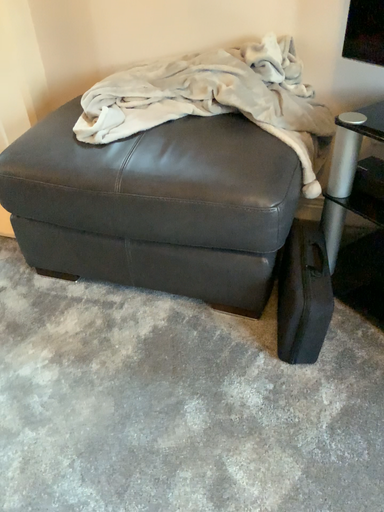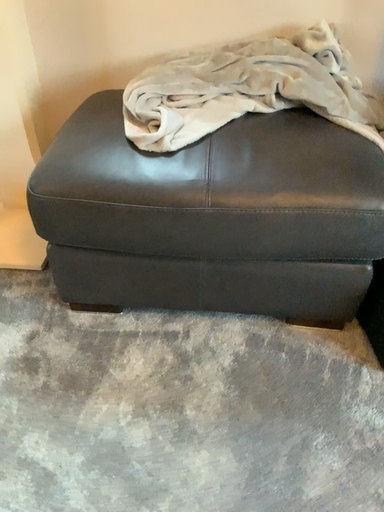
Question: How did the camera likely rotate when shooting the video?

Choices:
 (A) rotated left
 (B) rotated right

Answer: (B)